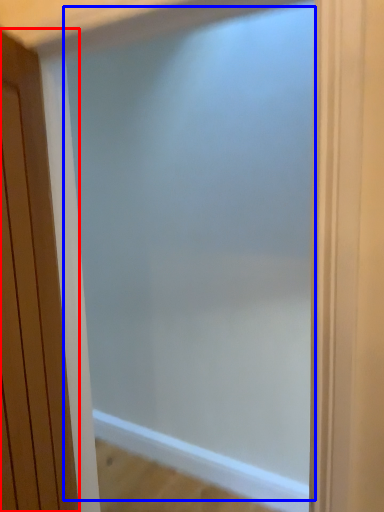
Question: Which object is closer to the camera taking this photo, door (highlighted by a red box) or screen door (highlighted by a blue box)?

Choices:
 (A) door
 (B) screen door

Answer: (A)